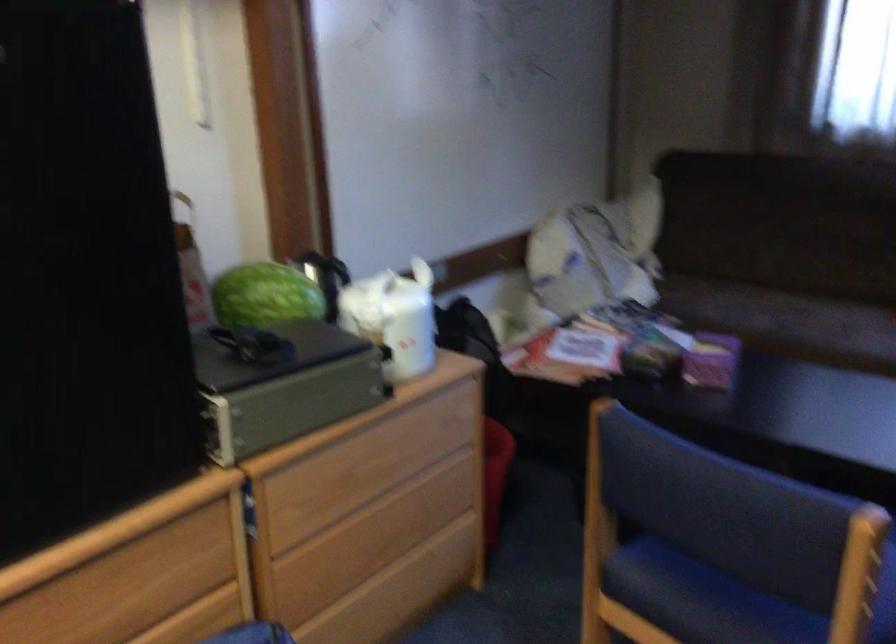
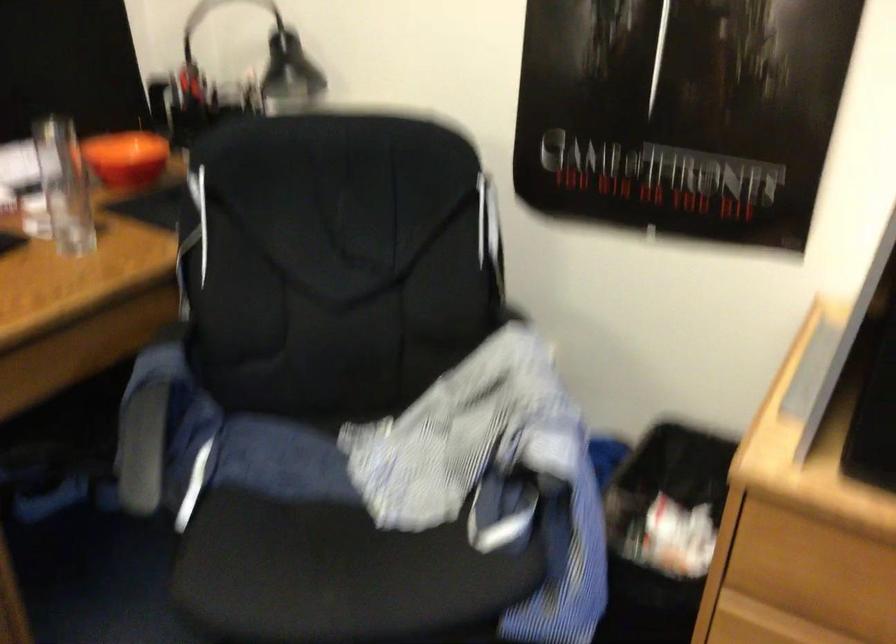
Based on the continuous images, in which direction is the camera rotating?

The camera's rotation is toward left-down.